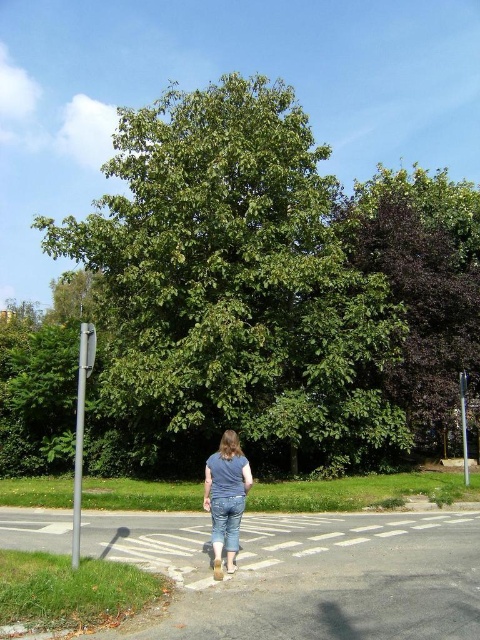
Is white asphalt at center smaller than blue denim jeans at center?

Indeed, white asphalt at center has a smaller size compared to blue denim jeans at center.

Who is higher up, white asphalt at center or blue denim jeans at center?

Positioned higher is blue denim jeans at center.

Is point (395, 541) farther from camera compared to point (225, 532)?

Yes, point (395, 541) is farther from viewer.

This screenshot has width=480, height=640. Find the location of `white asphalt at center`. white asphalt at center is located at coordinates (361, 541).

Between dark purple leafy tree at upper right and white asphalt at center, which one has more height?

Standing taller between the two is dark purple leafy tree at upper right.

Is dark purple leafy tree at upper right thinner than white asphalt at center?

No, dark purple leafy tree at upper right is not thinner than white asphalt at center.

Between point (425, 326) and point (427, 532), which one is positioned in front?

Point (427, 532) is more forward.

At what (x,y) coordinates should I click in order to perform the action: click on dark purple leafy tree at upper right. Please return your answer as a coordinate pair (x, y). Looking at the image, I should click on (424, 291).

Is dark purple leafy tree at upper right above blue denim jeans at center?

Yes, dark purple leafy tree at upper right is above blue denim jeans at center.

Between point (406, 188) and point (230, 456), which one is positioned in front?

Point (230, 456) is more forward.

You are a GUI agent. You are given a task and a screenshot of the screen. Output one action in this format:
    pyautogui.click(x=<x>, y=<y>)
    Task: Click on the dark purple leafy tree at upper right
    Image resolution: width=480 pixels, height=640 pixels.
    Given the screenshot: What is the action you would take?
    pyautogui.click(x=424, y=291)